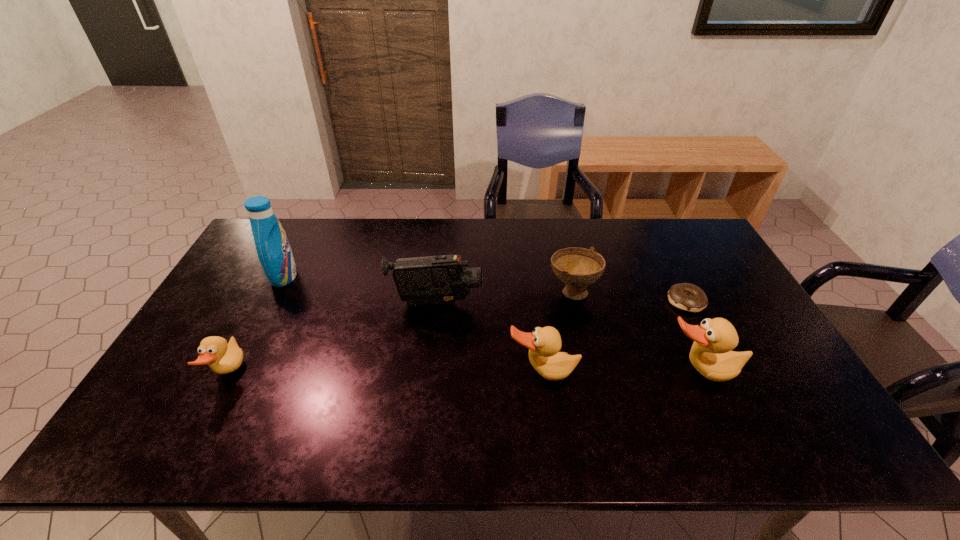
This screenshot has height=540, width=960. I want to click on blank area in the image that satisfies the following two spatial constraints: 1. on the front side of the soup bowl; 2. on the front-facing side of the camcorder, so click(575, 303).